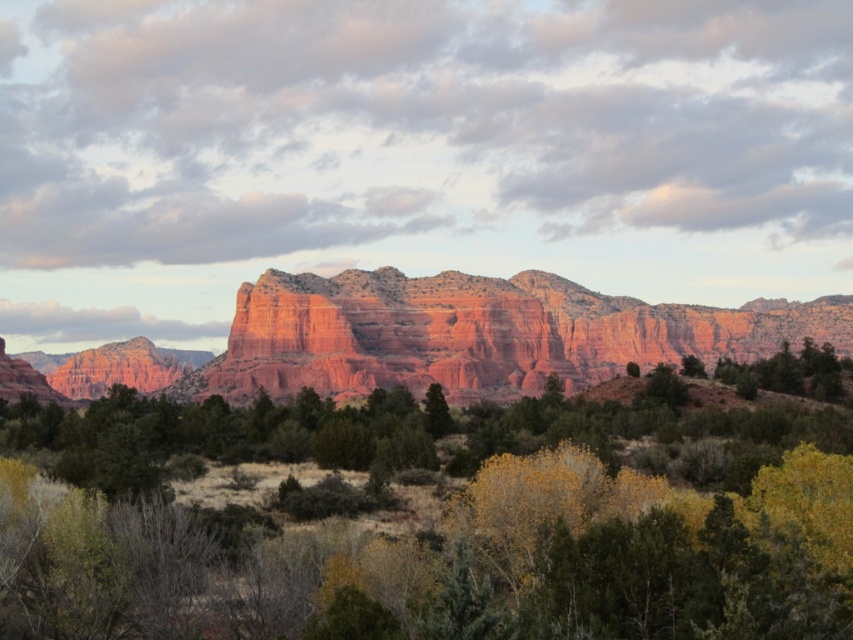
Does green leafy tree at center have a larger size compared to rustic sandstone mountain at center?

No, green leafy tree at center is not bigger than rustic sandstone mountain at center.

Which is behind, point (190, 515) or point (802, 316)?

The point (802, 316) is behind.

The height and width of the screenshot is (640, 853). In order to click on green leafy tree at center in this screenshot , I will do `click(428, 531)`.